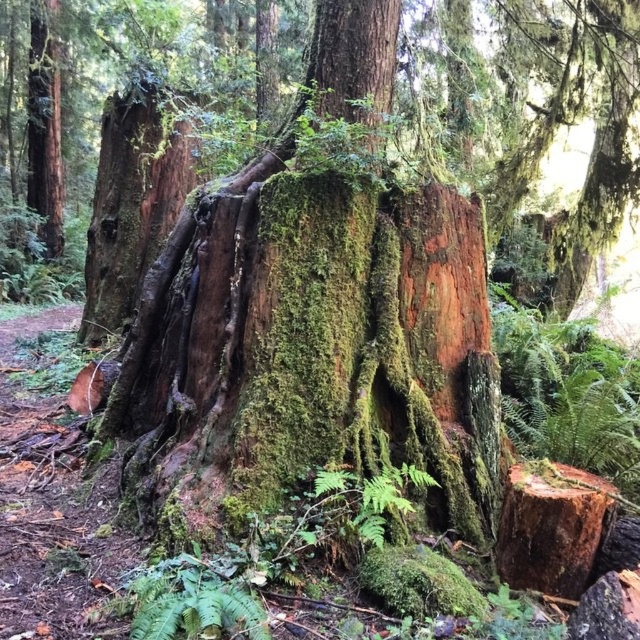
Question: Is green mossy stump at center smaller than smooth brown tree trunk at upper left?

Choices:
 (A) no
 (B) yes

Answer: (B)

Question: Which point is closer to the camera taking this photo?

Choices:
 (A) (502, 557)
 (B) (372, 492)
 (C) (61, 228)

Answer: (B)

Question: Is the position of smooth brown tree trunk at upper left more distant than that of green mossy fern at center?

Choices:
 (A) no
 (B) yes

Answer: (B)

Question: Is the position of green mossy stump at center less distant than that of smooth brown tree trunk at upper left?

Choices:
 (A) yes
 (B) no

Answer: (A)

Question: Which of the following is the closest to the observer?

Choices:
 (A) green mossy fern at center
 (B) smooth brown tree trunk at upper left
 (C) green mossy stump at center

Answer: (A)

Question: Among these points, which one is farthest from the camera?

Choices:
 (A) (513, 477)
 (B) (348, 481)

Answer: (A)